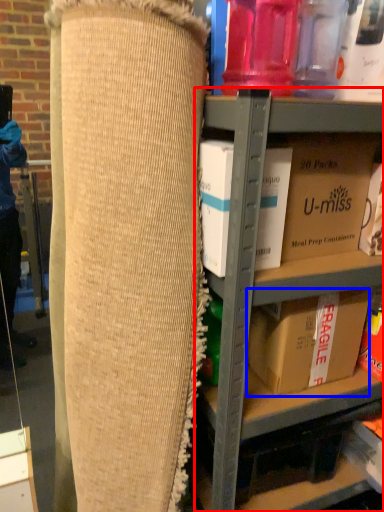
Question: Which object appears closest to the camera in this image, shelf (highlighted by a red box) or box (highlighted by a blue box)?

Choices:
 (A) shelf
 (B) box

Answer: (A)